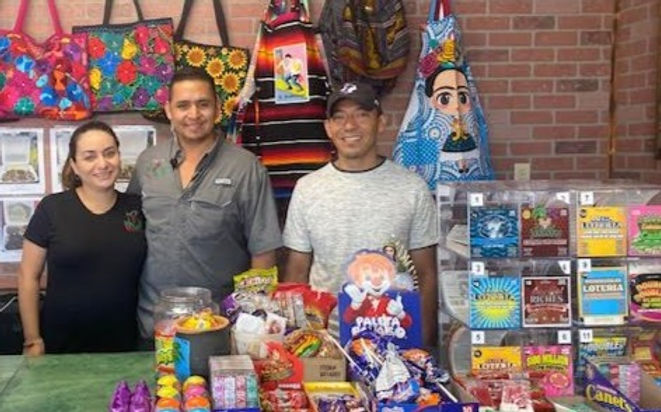
You are a GUI agent. You are given a task and a screenshot of the screen. Output one action in this format:
    pyautogui.click(x=<x>, y=<y>)
    Task: Click on the brick wall
    
    Given the screenshot: What is the action you would take?
    pyautogui.click(x=527, y=120), pyautogui.click(x=623, y=122)